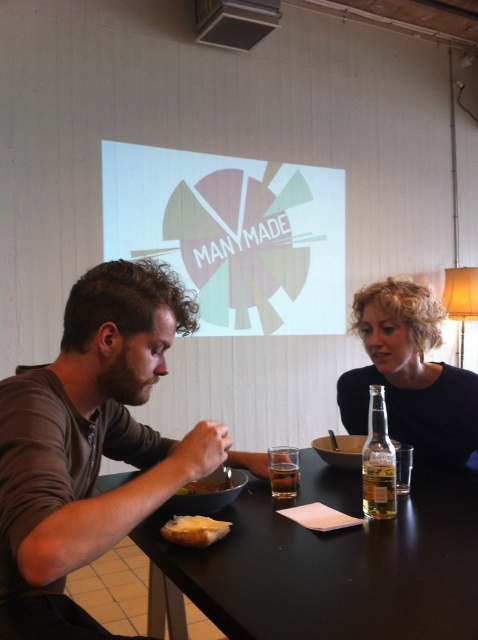
Is white bread at lower center shorter than green leafy vegetable at lower center?

Yes.

Is point (195, 528) closer to viewer compared to point (213, 484)?

Yes, point (195, 528) is closer to viewer.

Which is behind, point (175, 518) or point (181, 488)?

Positioned behind is point (181, 488).

This screenshot has width=478, height=640. Find the location of `white bread at lower center`. white bread at lower center is located at coordinates (195, 531).

In the scene shown: Is pastel paper projection at center positioned in front of matte black shirt at right?

No, pastel paper projection at center is further to the viewer.

I want to click on pastel paper projection at center, so click(232, 234).

Between clear glass bottle at right and green leafy vegetable at lower center, which one has more height?

With more height is clear glass bottle at right.

Can you confirm if clear glass bottle at right is smaller than green leafy vegetable at lower center?

Incorrect, clear glass bottle at right is not smaller in size than green leafy vegetable at lower center.

Which is in front, point (364, 452) or point (228, 480)?

Point (364, 452) is in front.

Identify the location of clear glass bottle at right. Image resolution: width=478 pixels, height=640 pixels. (378, 461).